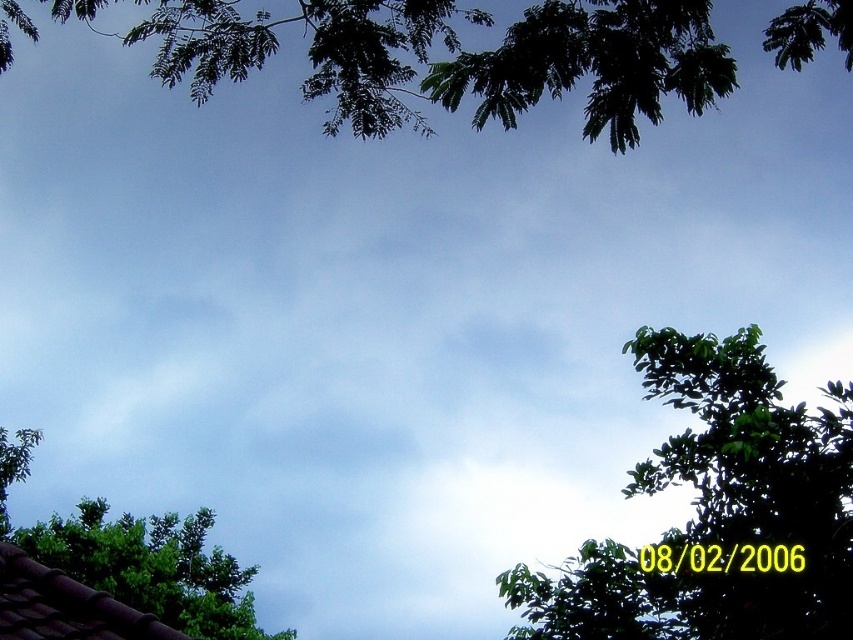
You are standing in a garden and want to take a photo of the green leafy branches at upper center and the green leafy tree at lower left. Which object is closer to the camera?

The green leafy branches at upper center is positioned over the green leafy tree at lower left, meaning it is closer to the camera.

You are a bird flying between the green leafy tree at right and the green leafy tree at lower left. If you can fly 10 meters in one minute, how long will it take you to fly between them?

The distance between the green leafy tree at right and the green leafy tree at lower left is 8.56 meters. Since you can fly 10 meters in one minute, it will take you approximately 0.856 minutes, which is about 51 seconds, to fly between them.

Based on the photo, you are standing in a garden and want to take a photo of both the point at coordinates point (x=815, y=577) and the point at coordinates point (x=3, y=538). Which point should you focus on first to ensure both are in focus?

You should focus on point (x=815, y=577) first because it is closer to you than point (x=3, y=538), ensuring both are in focus when using depth of field.